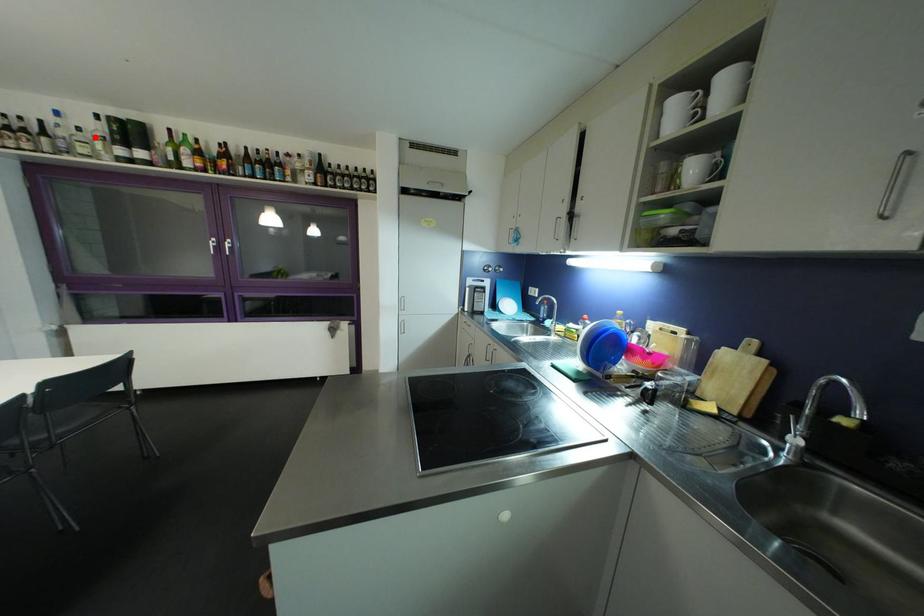
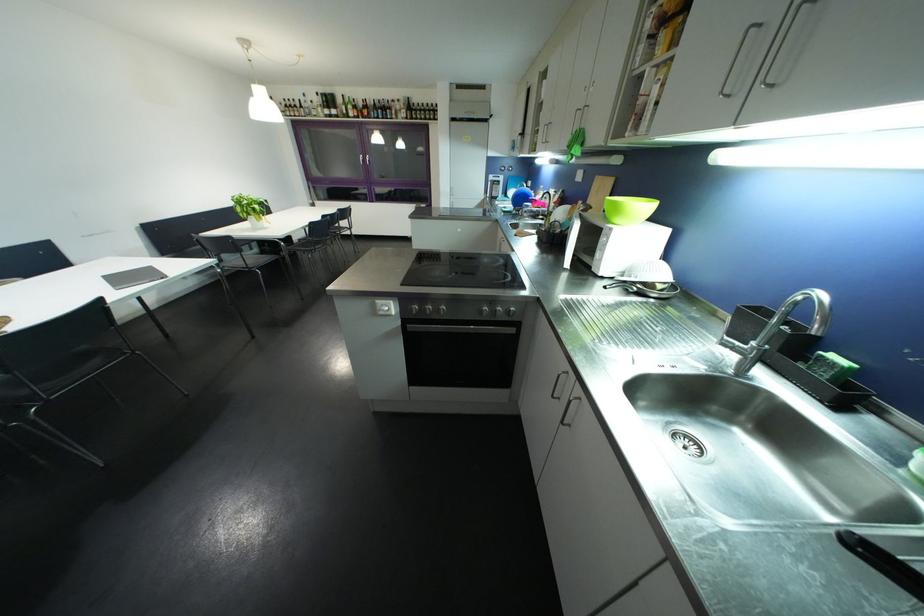
Question: I am providing you with two images of the same scene from different viewpoints. Given a red point in image1, look at the same physical point in image2. Is it:

Choices:
 (A) Closer to the viewpoint
 (B) Farther from the viewpoint

Answer: (A)